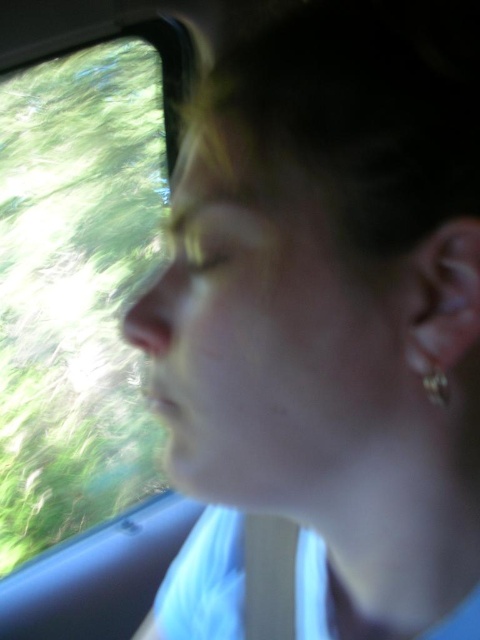
Who is lower down, transparent glass window at left or silver metallic earring at ear?

Result: Positioned lower is silver metallic earring at ear.

Is point (115, 180) positioned before point (432, 394)?

No, (115, 180) is behind (432, 394).

At what (x,y) coordinates should I click in order to perform the action: click on transparent glass window at left. Please return your answer as a coordinate pair (x, y). This screenshot has height=640, width=480. Looking at the image, I should click on (80, 276).